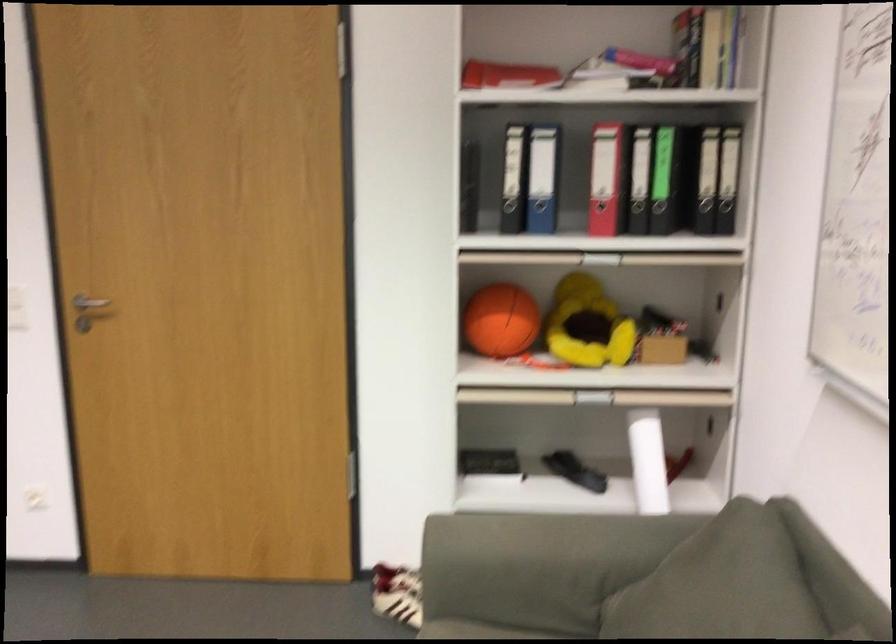
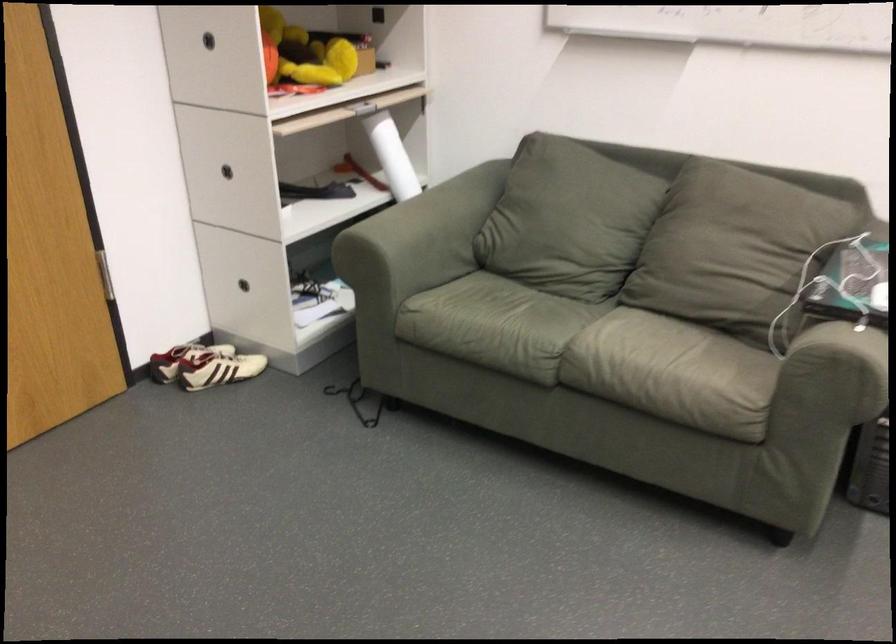
Where in the second image is the point corresponding to [636,456] from the first image?

(392, 156)